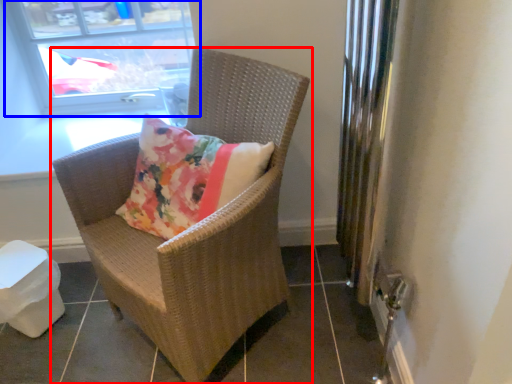
Question: Which point is further to the camera, chair (highlighted by a red box) or window (highlighted by a blue box)?

Choices:
 (A) chair
 (B) window

Answer: (B)